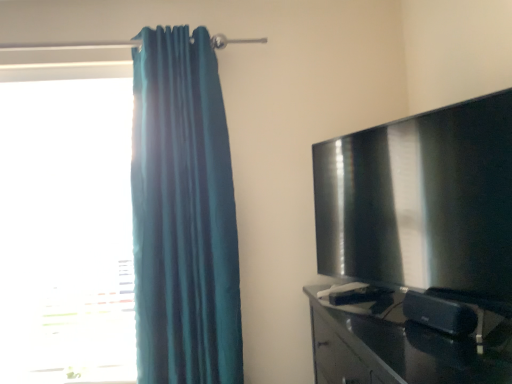
Identify the location of matte black tv at right. (416, 249).

What do you see at coordinates (416, 249) in the screenshot?
I see `matte black tv at right` at bounding box center [416, 249].

What are the coordinates of `glossy black tv stand at right` in the screenshot? It's located at (404, 344).

This screenshot has height=384, width=512. What do you see at coordinates (404, 344) in the screenshot? I see `glossy black tv stand at right` at bounding box center [404, 344].

The height and width of the screenshot is (384, 512). Describe the element at coordinates (66, 231) in the screenshot. I see `transparent glass window at left` at that location.

At what (x,y) coordinates should I click in order to perform the action: click on teal fabric curtain at left. Please return your answer as a coordinate pair (x, y). Looking at the image, I should click on (183, 214).

Who is shorter, teal fabric curtain at left or matte black tv at right?

Standing shorter between the two is matte black tv at right.

Is teal fabric curtain at left thinner than matte black tv at right?

Incorrect, the width of teal fabric curtain at left is not less than that of matte black tv at right.

Is teal fabric curtain at left beside matte black tv at right?

→ teal fabric curtain at left and matte black tv at right are clearly separated.

Between point (197, 327) and point (370, 322), which one is positioned in front?

The point (370, 322) is more forward.

How far apart are matte black tv at right and teal fabric curtain at left?

A distance of 65.90 centimeters exists between matte black tv at right and teal fabric curtain at left.

Is point (377, 333) positioned in front of point (147, 205)?

Yes, it is in front of point (147, 205).

Which object is positioned more to the left, matte black tv at right or teal fabric curtain at left?

From the viewer's perspective, teal fabric curtain at left appears more on the left side.

Consider the image. Is matte black tv at right situated inside teal fabric curtain at left or outside?

matte black tv at right is not enclosed by teal fabric curtain at left.

Is transparent glass window at left bigger or smaller than glossy black tv stand at right?

Considering their sizes, transparent glass window at left takes up less space than glossy black tv stand at right.

From the image's perspective, between transparent glass window at left and glossy black tv stand at right, which one is located above?

transparent glass window at left is shown above in the image.

In the scene shown: How far apart are transparent glass window at left and glossy black tv stand at right?

transparent glass window at left and glossy black tv stand at right are 1.21 meters apart from each other.

Can you confirm if transparent glass window at left is taller than glossy black tv stand at right?

Indeed, transparent glass window at left has a greater height compared to glossy black tv stand at right.

Is teal fabric curtain at left touching glossy black tv stand at right?

No, teal fabric curtain at left is not in contact with glossy black tv stand at right.

Is teal fabric curtain at left positioned beyond the bounds of glossy black tv stand at right?

Yes, teal fabric curtain at left is not within glossy black tv stand at right.

Where is `curtain above the glossy black tv stand at right (from the image's perspective)`? This screenshot has width=512, height=384. curtain above the glossy black tv stand at right (from the image's perspective) is located at coordinates (183, 214).

Can you confirm if teal fabric curtain at left is positioned to the right of glossy black tv stand at right?

Incorrect, teal fabric curtain at left is not on the right side of glossy black tv stand at right.

Based on the photo, which object is further away from the camera, matte black tv at right or glossy black tv stand at right?

matte black tv at right.

From the image's perspective, would you say matte black tv at right is positioned over glossy black tv stand at right?

Indeed, from the image's perspective, matte black tv at right is shown above glossy black tv stand at right.

Considering the relative sizes of matte black tv at right and glossy black tv stand at right in the image provided, is matte black tv at right smaller than glossy black tv stand at right?

Indeed, matte black tv at right has a smaller size compared to glossy black tv stand at right.

From a real-world perspective, is matte black tv at right physically located above or below glossy black tv stand at right?

Clearly, from a real-world perspective, matte black tv at right is above glossy black tv stand at right.

From the picture: Is transparent glass window at left oriented towards matte black tv at right?

No, transparent glass window at left is not facing towards matte black tv at right.

Considering the positions of objects transparent glass window at left and matte black tv at right in the image provided, who is behind, transparent glass window at left or matte black tv at right?

transparent glass window at left is behind.

Looking at their sizes, would you say transparent glass window at left is wider or thinner than matte black tv at right?

Considering their sizes, transparent glass window at left looks slimmer than matte black tv at right.

How far apart are transparent glass window at left and matte black tv at right?

transparent glass window at left and matte black tv at right are 1.21 meters apart from each other.

How distant is transparent glass window at left from teal fabric curtain at left?

transparent glass window at left is 18.56 inches from teal fabric curtain at left.

Considering the relative sizes of transparent glass window at left and teal fabric curtain at left in the image provided, is transparent glass window at left shorter than teal fabric curtain at left?

Indeed, transparent glass window at left has a lesser height compared to teal fabric curtain at left.

Is transparent glass window at left directly adjacent to teal fabric curtain at left?

There is a gap between transparent glass window at left and teal fabric curtain at left.

Identify the location of curtain on the left of matte black tv at right. (183, 214).

Identify the location of entertainment center in front of the teal fabric curtain at left. (416, 249).

From the image, which object appears to be nearer to glossy black tv stand at right, teal fabric curtain at left or matte black tv at right?

Based on the image, matte black tv at right appears to be nearer to glossy black tv stand at right.

When comparing their distances from matte black tv at right, does glossy black tv stand at right or teal fabric curtain at left seem further?

teal fabric curtain at left is further to matte black tv at right.

Looking at the image, which one is located closer to matte black tv at right, glossy black tv stand at right or transparent glass window at left?

glossy black tv stand at right.

Considering their positions, is teal fabric curtain at left positioned closer to glossy black tv stand at right than transparent glass window at left?

teal fabric curtain at left.

From the image, which object appears to be nearer to teal fabric curtain at left, matte black tv at right or transparent glass window at left?

transparent glass window at left.

Which object lies nearer to the anchor point matte black tv at right, teal fabric curtain at left or glossy black tv stand at right?

glossy black tv stand at right is positioned closer to the anchor matte black tv at right.

Looking at the image, which one is located further to transparent glass window at left, teal fabric curtain at left or matte black tv at right?

The object further to transparent glass window at left is matte black tv at right.

Estimate the real-world distances between objects in this image. Which object is further from matte black tv at right, transparent glass window at left or glossy black tv stand at right?

Based on the image, transparent glass window at left appears to be further to matte black tv at right.

Image resolution: width=512 pixels, height=384 pixels. In order to click on entertainment center located between teal fabric curtain at left and glossy black tv stand at right in the left-right direction in this screenshot , I will do `click(416, 249)`.

The image size is (512, 384). I want to click on curtain situated between transparent glass window at left and glossy black tv stand at right from left to right, so click(x=183, y=214).

Find the location of `entertainment center located between transparent glass window at left and glossy black tv stand at right in the left-right direction`. entertainment center located between transparent glass window at left and glossy black tv stand at right in the left-right direction is located at coordinates (416, 249).

This screenshot has width=512, height=384. I want to click on curtain between transparent glass window at left and matte black tv at right, so click(183, 214).